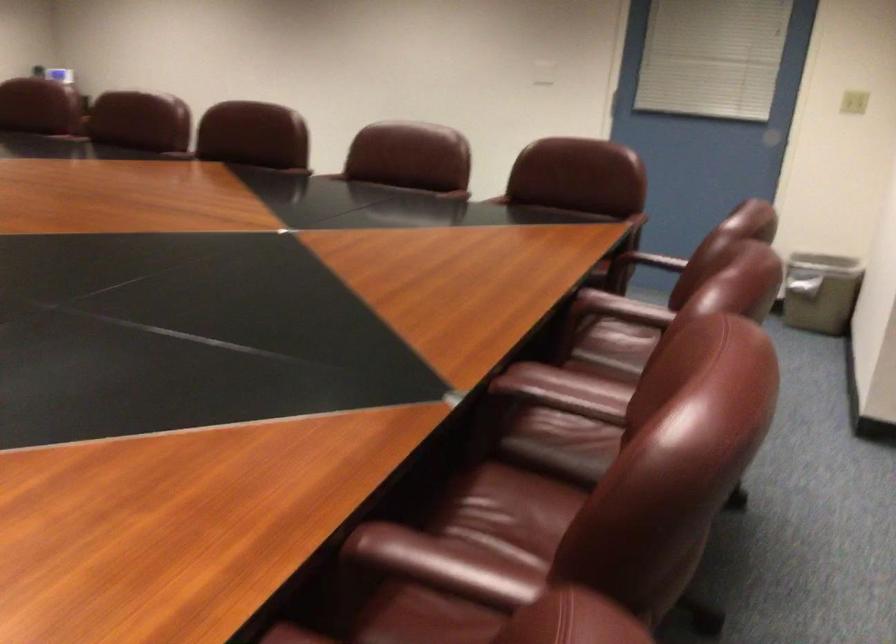
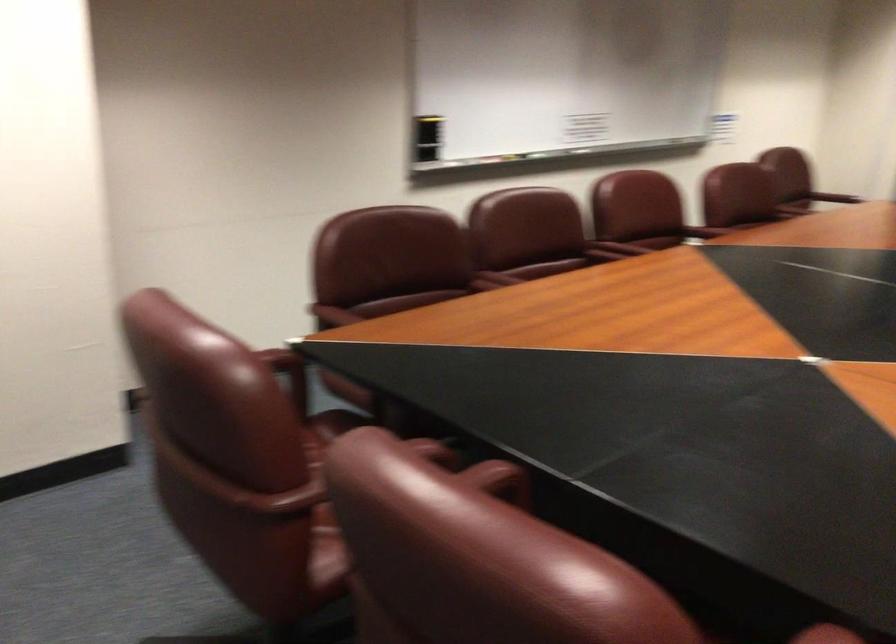
Find the pixel in the second image that matches pixel 659 313 in the first image.

(497, 277)